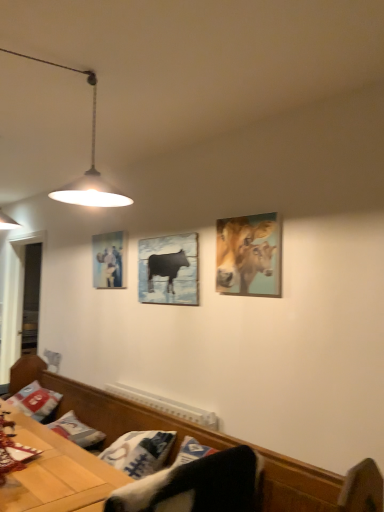
The image size is (384, 512). Identify the location of empty space that is ontop of wooden table at lower left (from a real-world perspective). (49, 457).